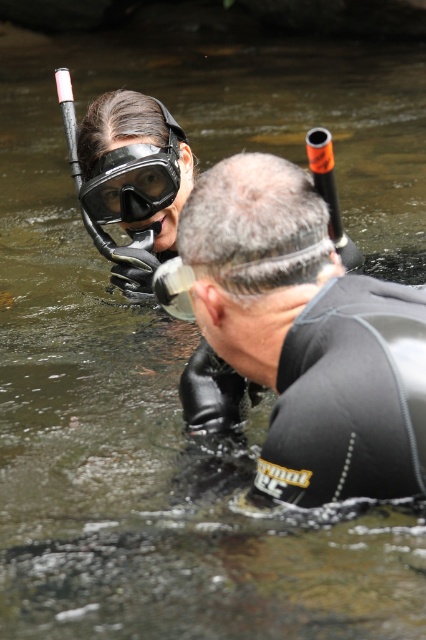
Question: Which point appears closest to the camera in this image?

Choices:
 (A) (166, 204)
 (B) (282, 440)

Answer: (B)

Question: Does black rubber wetsuit at center have a larger size compared to matte black goggles at upper left?

Choices:
 (A) yes
 (B) no

Answer: (A)

Question: Among these objects, which one is farthest from the camera?

Choices:
 (A) matte black goggles at upper left
 (B) black rubber wetsuit at center

Answer: (A)

Question: Can you confirm if black rubber wetsuit at center is wider than matte black goggles at upper left?

Choices:
 (A) no
 (B) yes

Answer: (B)

Question: Is black rubber wetsuit at center below matte black goggles at upper left?

Choices:
 (A) yes
 (B) no

Answer: (A)

Question: Which point is farther from the camera taking this photo?

Choices:
 (A) (85, 180)
 (B) (334, 472)

Answer: (A)